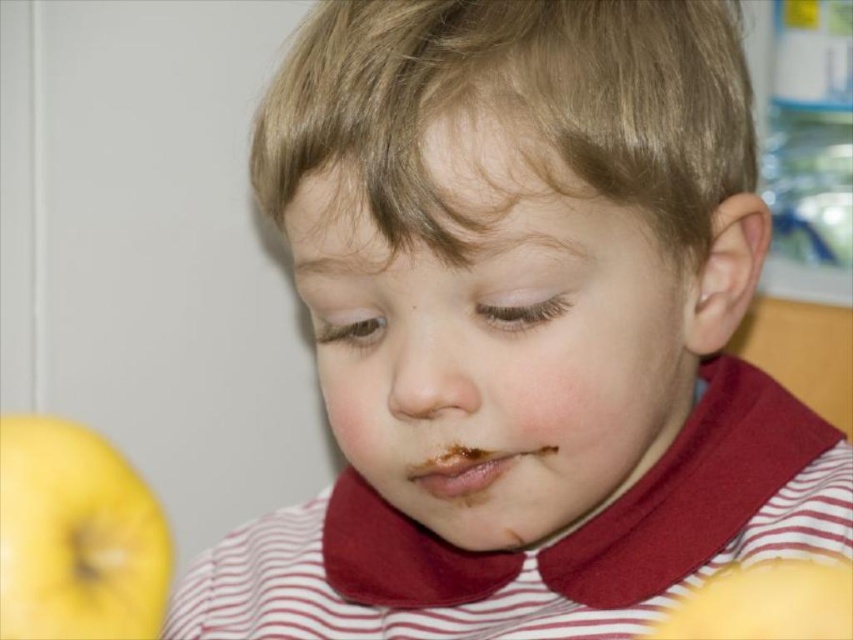
Question: Is smooth skin face at center below yellow matte apple at lower left?

Choices:
 (A) no
 (B) yes

Answer: (A)

Question: Which object appears closest to the camera in this image?

Choices:
 (A) yellow matte apple at lower left
 (B) smooth skin face at center

Answer: (A)

Question: Where is smooth skin face at center located in relation to yellow matte apple at lower left in the image?

Choices:
 (A) right
 (B) left

Answer: (A)

Question: Is smooth skin face at center positioned behind yellow matte apple at lower left?

Choices:
 (A) no
 (B) yes

Answer: (B)